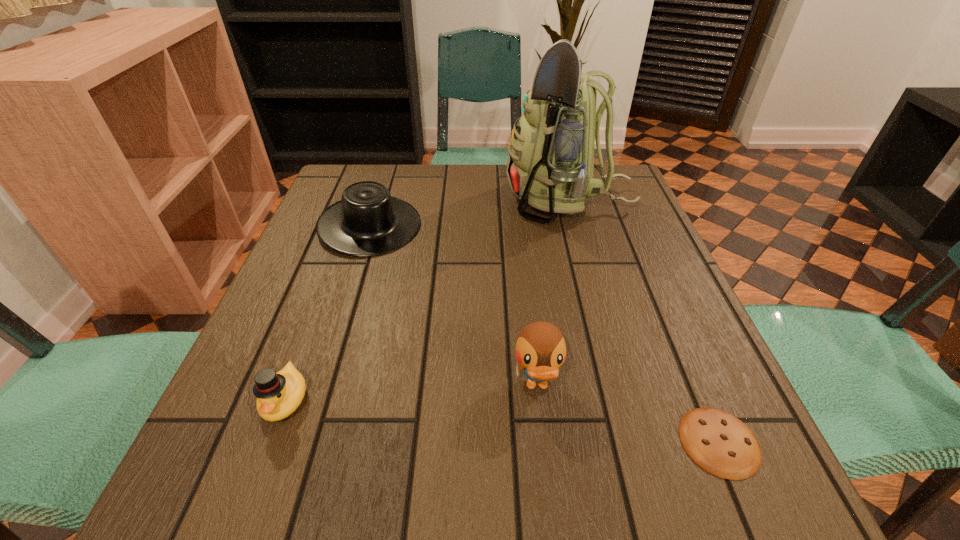
This screenshot has height=540, width=960. Find the location of `vacant point located 0.120m on the front of the dress hat`. vacant point located 0.120m on the front of the dress hat is located at coordinates (348, 295).

Identify the location of vacant point located 0.100m on the front-facing side of the left duck. (249, 498).

I want to click on free point located 0.220m on the back of the cookie, so click(x=663, y=309).

The image size is (960, 540). What are the coordinates of `backpack that is at the far edge` in the screenshot? It's located at (550, 162).

Find the location of a particular element. dress hat at the far edge is located at coordinates (367, 221).

Locate an element on the screen. This screenshot has width=960, height=540. object located in the near edge section of the desktop is located at coordinates (721, 444).

At what (x,y) coordinates should I click in order to perform the action: click on dress hat at the left edge. Please return your answer as a coordinate pair (x, y). Looking at the image, I should click on coord(367,221).

Locate an element on the screen. duck situated at the left edge is located at coordinates (279, 394).

At what (x,y) coordinates should I click in order to perform the action: click on backpack that is at the right edge. Please return your answer as a coordinate pair (x, y). Looking at the image, I should click on (550, 162).

I want to click on cookie present at the right edge, so click(721, 444).